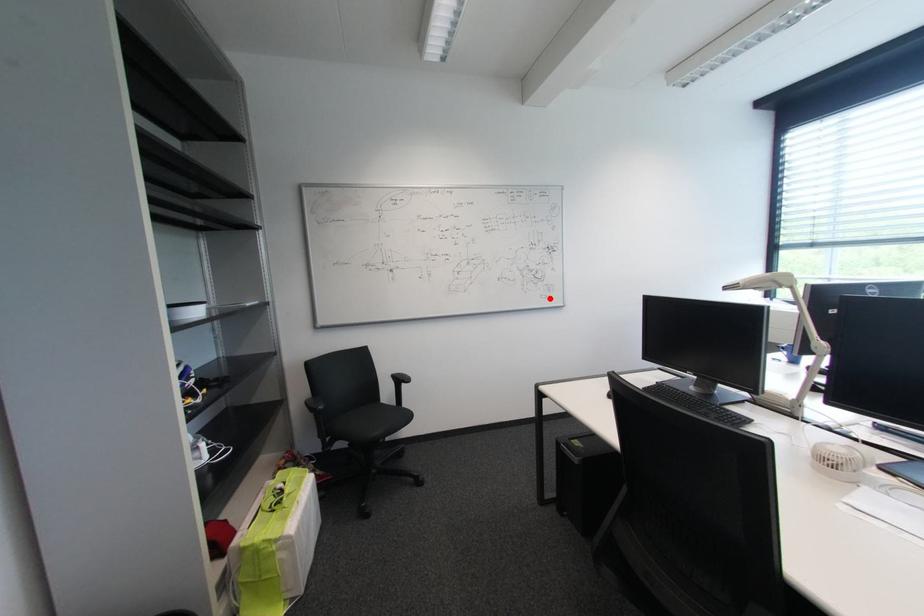
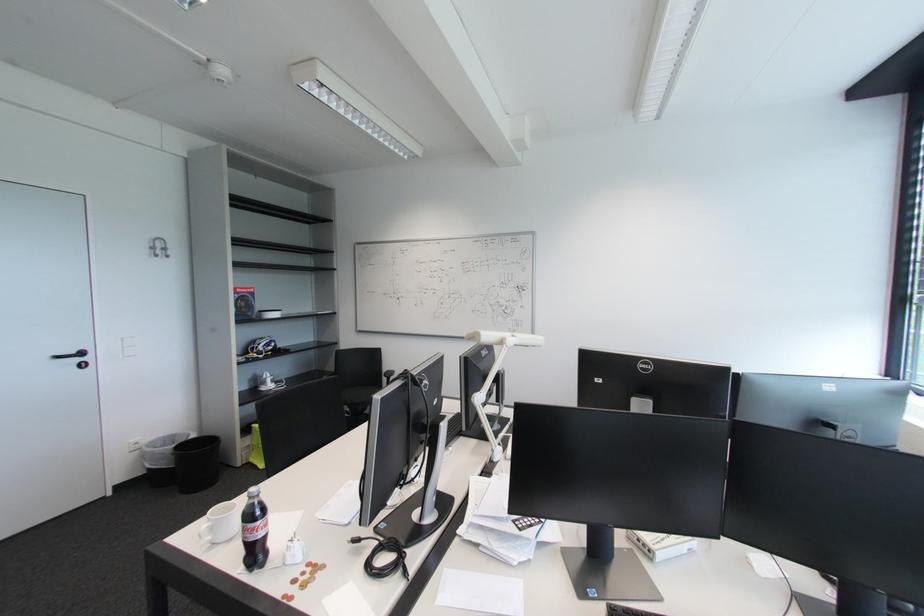
The point at the highlighted location is marked in the first image. Where is the corresponding point in the second image?

(517, 331)